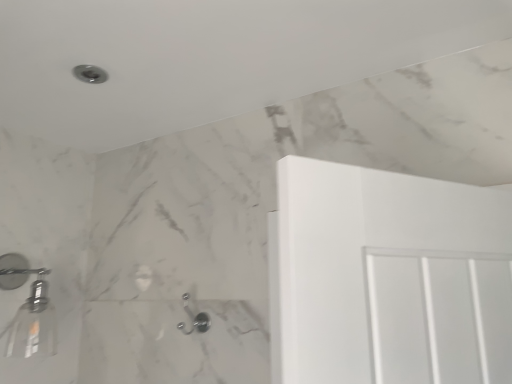
Question: Can matte silver shower at upper left, placed as the 1th shower when sorted from top to bottom, be found inside satin nickel hook at lower center, which ranks as the first shower in bottom-to-top order?

Choices:
 (A) no
 (B) yes

Answer: (A)

Question: Can you confirm if satin nickel hook at lower center, which is the third shower from left to right, is wider than matte silver shower at upper left, which appears as the 2th shower when viewed from the left?

Choices:
 (A) no
 (B) yes

Answer: (A)

Question: Is satin nickel hook at lower center, the 3th shower in the top-to-bottom sequence, shorter than matte silver shower at upper left, which appears as the 2th shower when viewed from the left?

Choices:
 (A) yes
 (B) no

Answer: (B)

Question: Is satin nickel hook at lower center, the 3th shower in the top-to-bottom sequence, not within matte silver shower at upper left, which appears as the 2th shower when viewed from the left?

Choices:
 (A) no
 (B) yes

Answer: (B)

Question: From a real-world perspective, is satin nickel hook at lower center, which is the third shower from left to right, positioned under matte silver shower at upper left, which appears as the 2th shower when viewed from the left, based on gravity?

Choices:
 (A) no
 (B) yes

Answer: (B)

Question: Looking at the image, does metallic silver showerhead at left, positioned as the 1th shower in left-to-right order, seem bigger or smaller compared to matte silver shower at upper left, placed as the 1th shower when sorted from top to bottom?

Choices:
 (A) big
 (B) small

Answer: (A)

Question: Does point (48, 304) appear closer or farther from the camera than point (73, 69)?

Choices:
 (A) closer
 (B) farther

Answer: (B)

Question: From their relative heights in the image, would you say metallic silver showerhead at left, arranged as the second shower when viewed from the top, is taller or shorter than matte silver shower at upper left, the 2th shower when ordered from right to left?

Choices:
 (A) short
 (B) tall

Answer: (B)

Question: Is metallic silver showerhead at left, positioned as the 1th shower in left-to-right order, in front of or behind matte silver shower at upper left, which appears as the 2th shower when viewed from the left, in the image?

Choices:
 (A) behind
 (B) front

Answer: (A)

Question: Based on their sizes in the image, would you say satin nickel hook at lower center, which ranks as the first shower in bottom-to-top order, is bigger or smaller than metallic silver showerhead at left, which appears as the second shower when ordered from the bottom?

Choices:
 (A) small
 (B) big

Answer: (A)

Question: Would you say satin nickel hook at lower center, the 3th shower in the top-to-bottom sequence, is to the left or to the right of metallic silver showerhead at left, positioned as the 3th shower in right-to-left order, in the picture?

Choices:
 (A) right
 (B) left

Answer: (A)

Question: In terms of width, does satin nickel hook at lower center, which ranks as the first shower in bottom-to-top order, look wider or thinner when compared to metallic silver showerhead at left, arranged as the second shower when viewed from the top?

Choices:
 (A) wide
 (B) thin

Answer: (B)

Question: Does point (186, 311) appear closer or farther from the camera than point (17, 312)?

Choices:
 (A) closer
 (B) farther

Answer: (B)

Question: Considering the positions of matte silver shower at upper left, placed as the 1th shower when sorted from top to bottom, and satin nickel hook at lower center, which ranks as the first shower in bottom-to-top order, in the image, is matte silver shower at upper left, placed as the 1th shower when sorted from top to bottom, taller or shorter than satin nickel hook at lower center, which ranks as the first shower in bottom-to-top order,?

Choices:
 (A) tall
 (B) short

Answer: (B)

Question: From the image's perspective, is matte silver shower at upper left, placed as the 1th shower when sorted from top to bottom, above or below satin nickel hook at lower center, which is the third shower from left to right?

Choices:
 (A) below
 (B) above

Answer: (B)